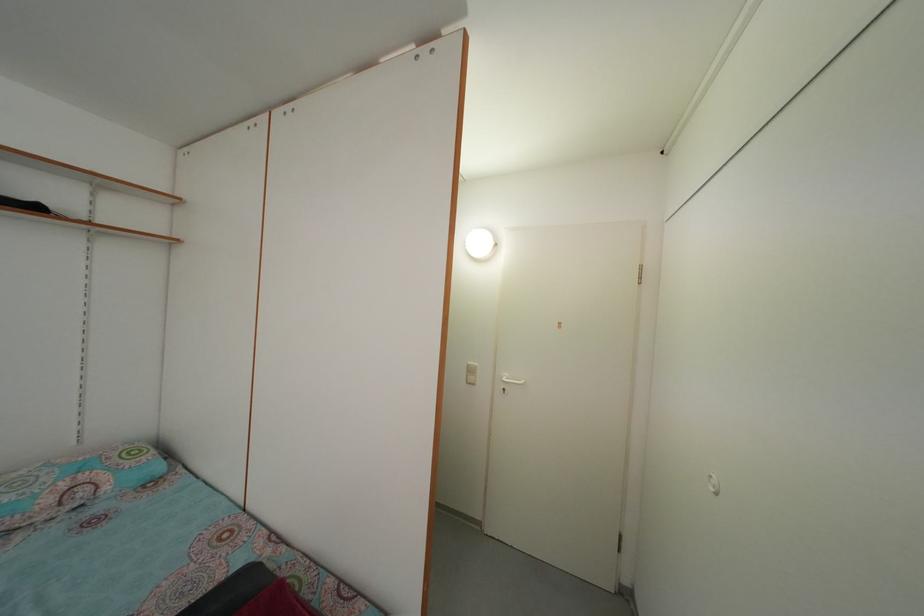
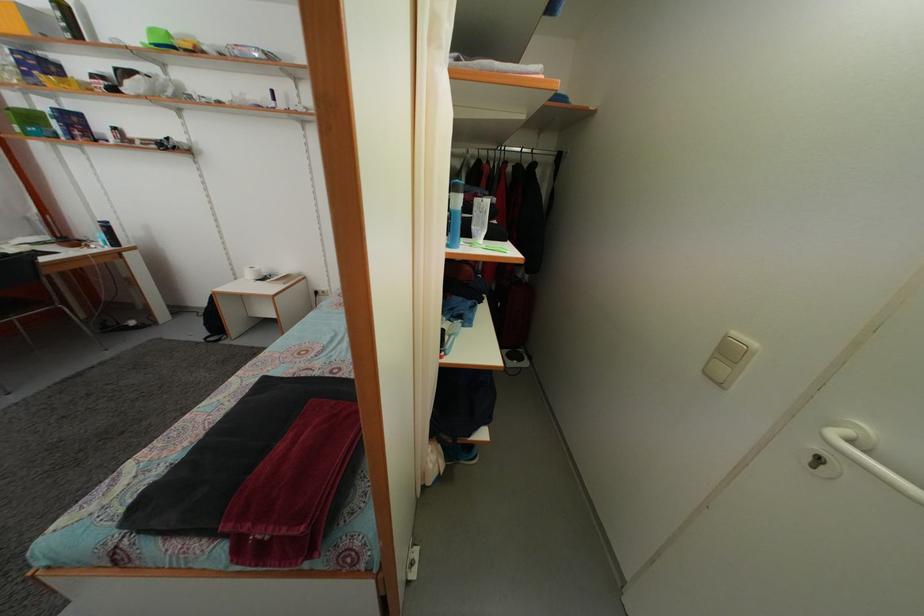
The first image is from the beginning of the video and the second image is from the end. How did the camera likely rotate when shooting the video?

The camera rotated toward left-down.